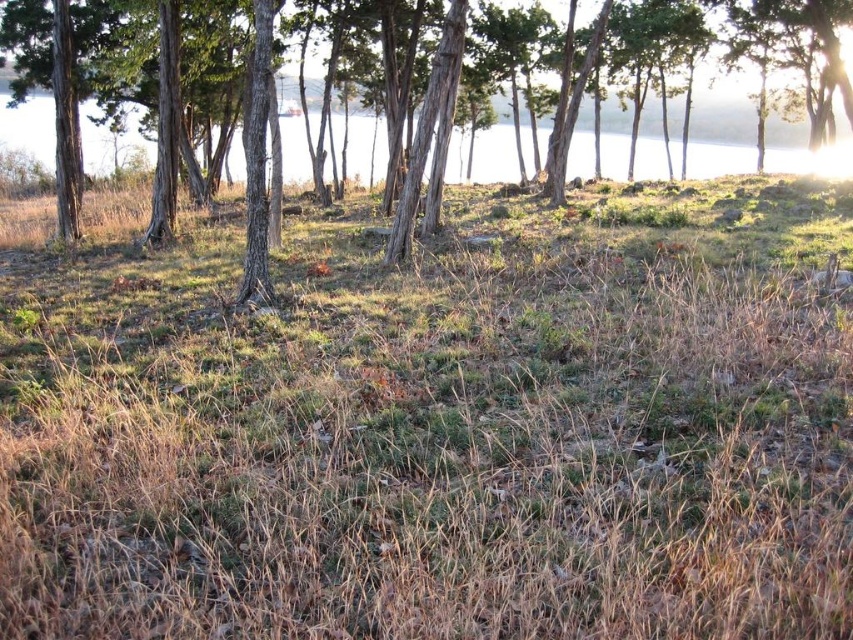
Question: Observing the image, what is the correct spatial positioning of clear water at center in reference to brown rough tree at center?

Choices:
 (A) right
 (B) left

Answer: (B)

Question: Can you confirm if clear water at center is smaller than brown rough tree at center?

Choices:
 (A) yes
 (B) no

Answer: (A)

Question: Which of the following is the closest to the observer?

Choices:
 (A) (299, 145)
 (B) (720, 609)
 (C) (711, 157)

Answer: (B)

Question: Which of the following is the farthest from the observer?

Choices:
 (A) clear water at center
 (B) brown dry grass at center

Answer: (A)

Question: Which of the following is the closest to the observer?

Choices:
 (A) brown rough tree at center
 (B) clear water at center

Answer: (A)

Question: Does clear water at center appear over brown rough tree at center?

Choices:
 (A) yes
 (B) no

Answer: (A)